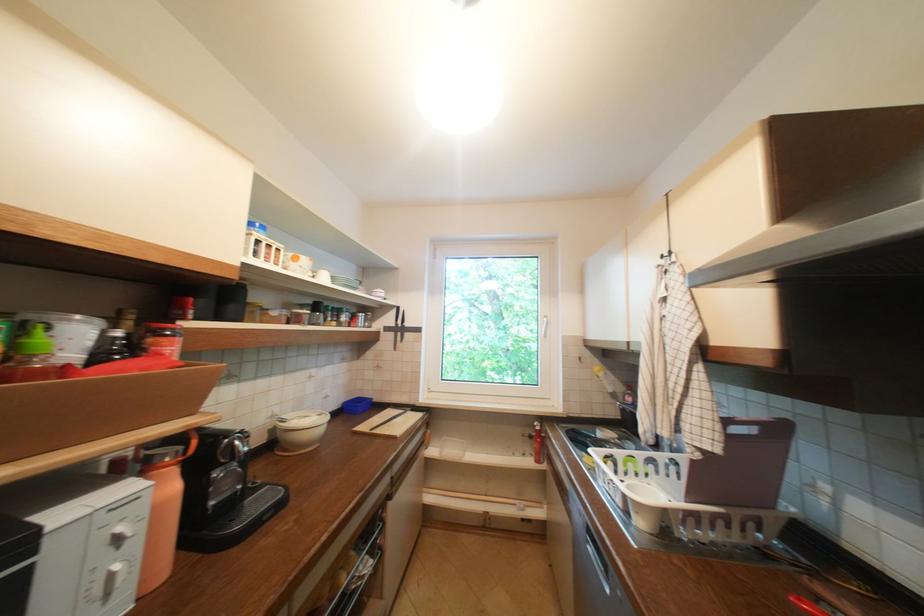
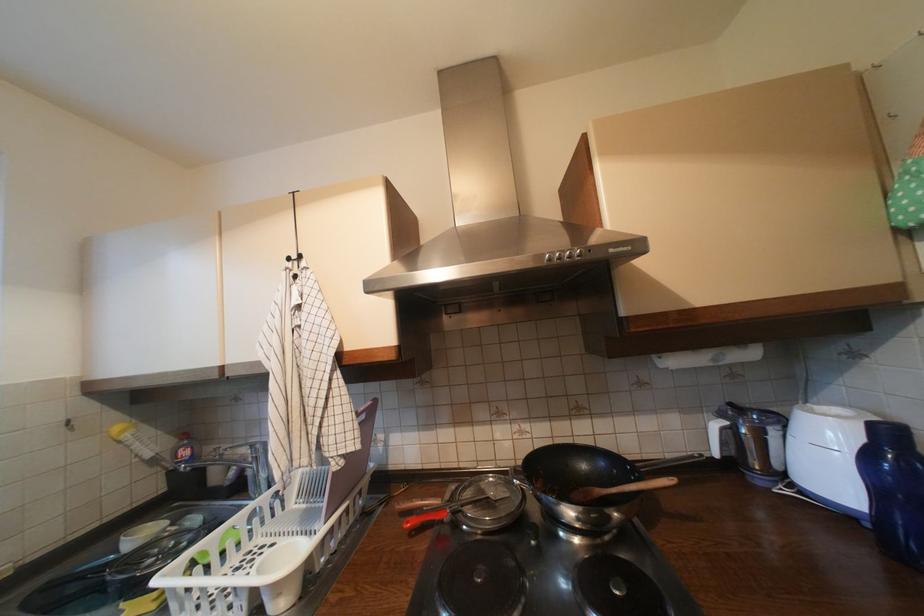
Question: The images are taken continuously from a first-person perspective. In which direction is your viewpoint rotating?

Choices:
 (A) Left
 (B) Right
 (C) Up
 (D) Down

Answer: (B)